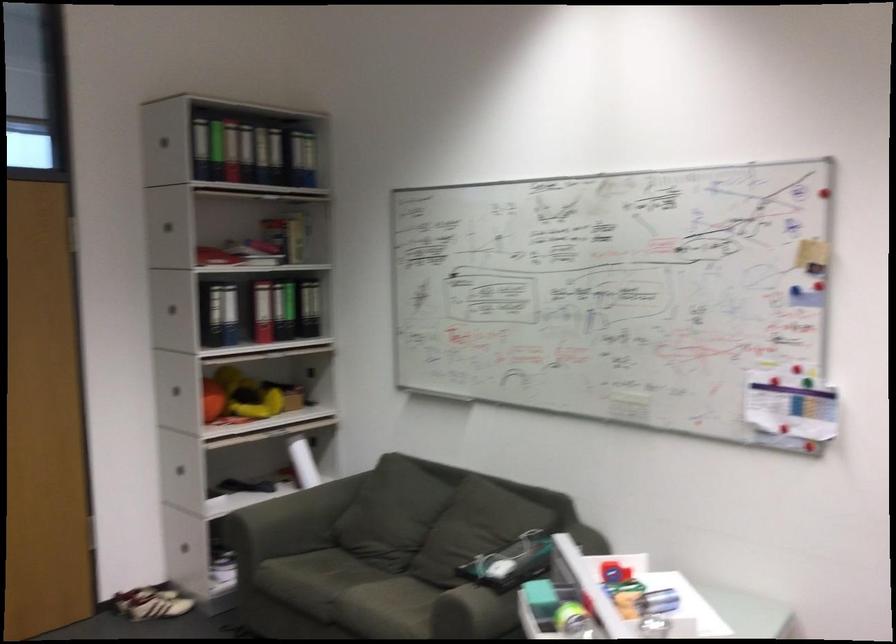
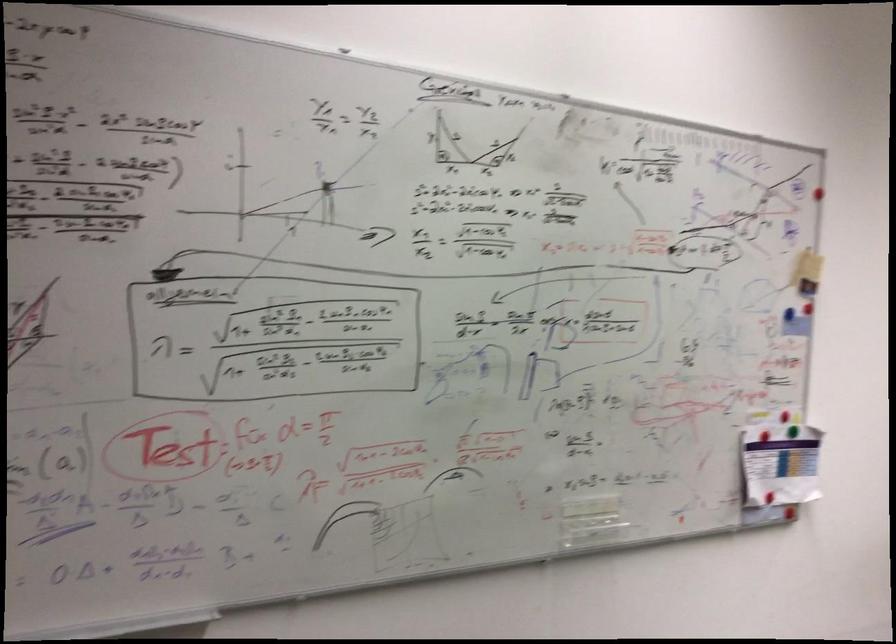
Locate, in the second image, the point that corresponds to point (806, 249) in the first image.

(805, 267)